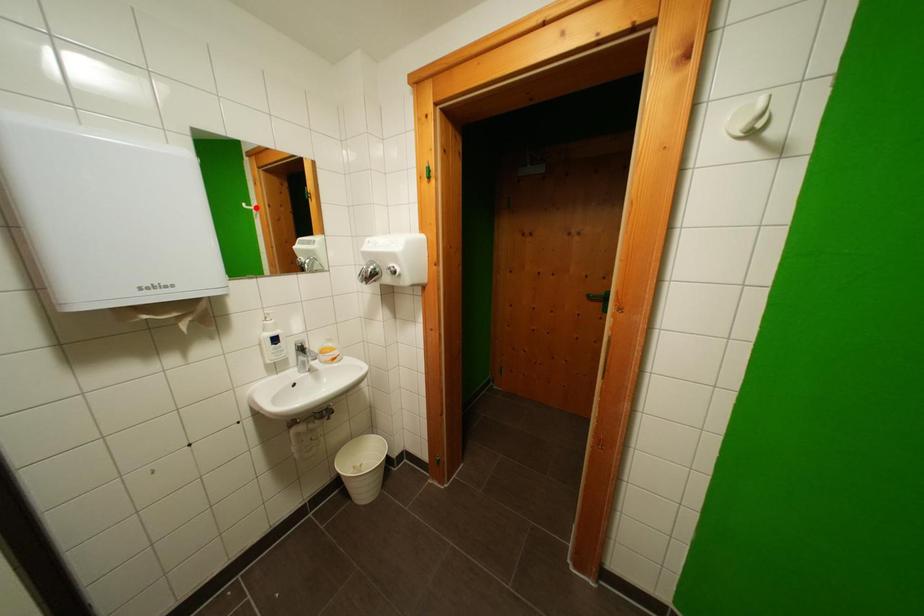
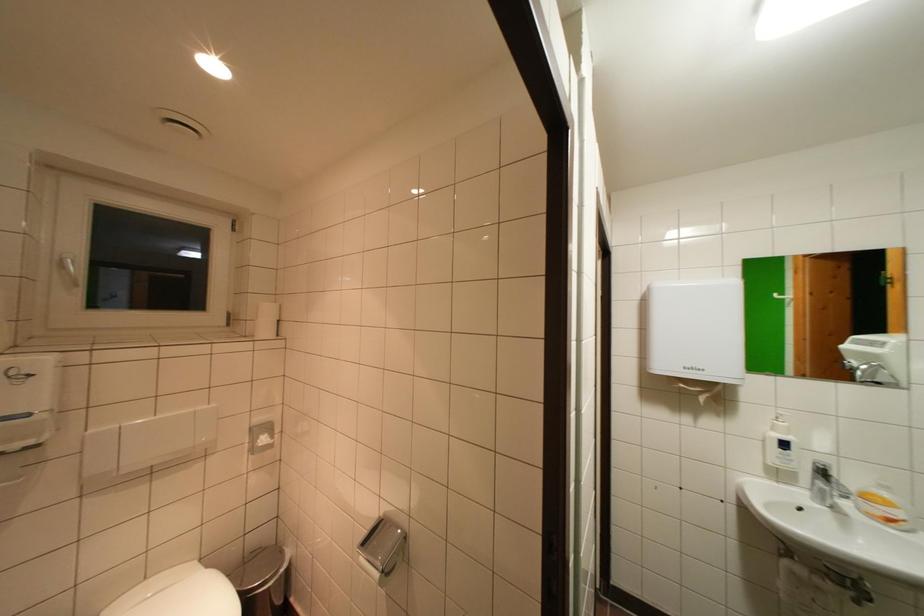
Question: I am providing you with two images of the same scene from different viewpoints. A red point is marked on the first image. At the location where the point appears in image 1, is it still visible in image 2?

Choices:
 (A) Yes
 (B) No

Answer: (A)